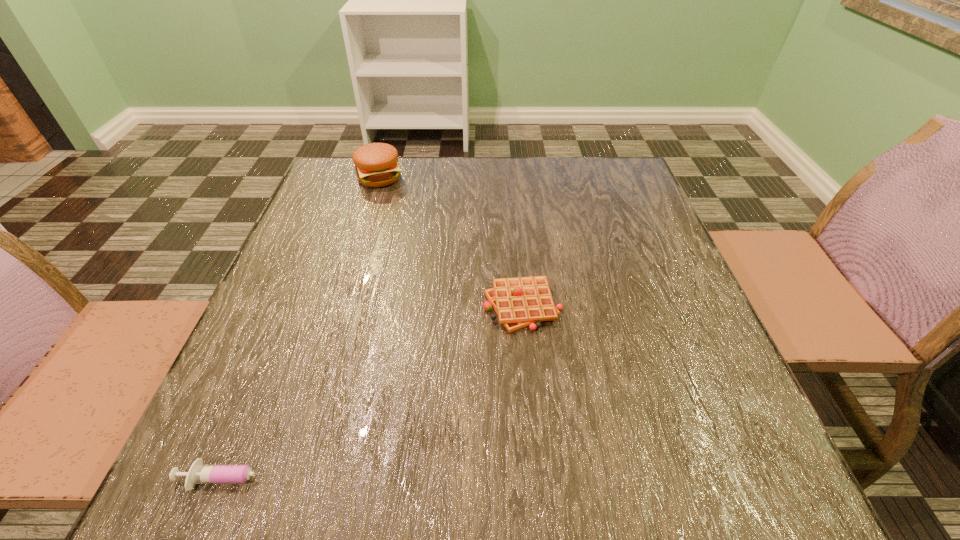
At what (x,y) coordinates should I click in order to perform the action: click on object that is at the near edge. Please return your answer as a coordinate pair (x, y). Looking at the image, I should click on (198, 473).

Where is `hamburger at the left edge`? The image size is (960, 540). hamburger at the left edge is located at coordinates (376, 164).

Identify the location of syringe at the left edge. This screenshot has width=960, height=540. (198, 473).

You are a GUI agent. You are given a task and a screenshot of the screen. Output one action in this format:
    pyautogui.click(x=<x>, y=<y>)
    Task: Click on the object that is positioned at the far left corner
    
    Given the screenshot: What is the action you would take?
    pyautogui.click(x=376, y=164)

You are a GUI agent. You are given a task and a screenshot of the screen. Output one action in this format:
    pyautogui.click(x=<x>, y=<y>)
    Task: Click on the object located at the near left corner
    This screenshot has height=540, width=960.
    Given the screenshot: What is the action you would take?
    pyautogui.click(x=198, y=473)

Image resolution: width=960 pixels, height=540 pixels. Find the location of `free space at the far edge of the desktop`. free space at the far edge of the desktop is located at coordinates (493, 185).

Where is `free space at the near edge of the desktop`? The image size is (960, 540). free space at the near edge of the desktop is located at coordinates (306, 496).

I want to click on vacant space at the left edge of the desktop, so click(339, 301).

At what (x,y) coordinates should I click in order to perform the action: click on free point at the right edge. Please return your answer as a coordinate pair (x, y). The image size is (960, 540). Looking at the image, I should click on (736, 429).

Where is `vacant space at the far left corner of the desktop`? vacant space at the far left corner of the desktop is located at coordinates (348, 184).